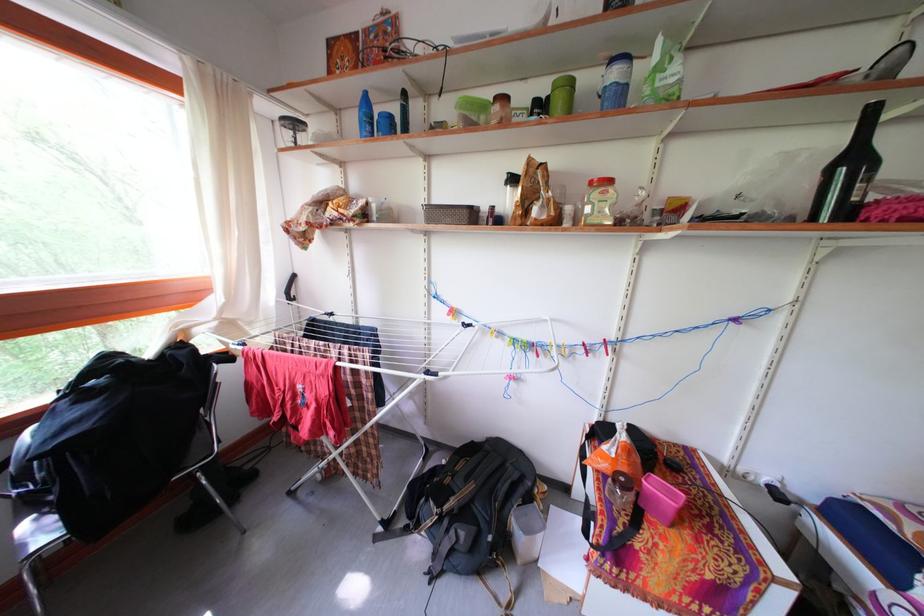
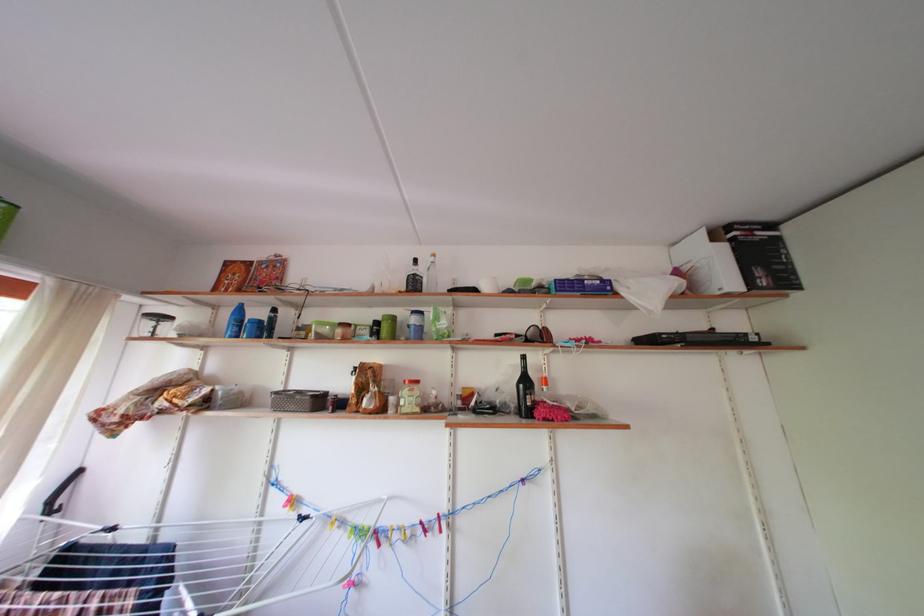
The point at (861,166) is marked in the first image. Where is the corresponding point in the second image?

(533, 387)